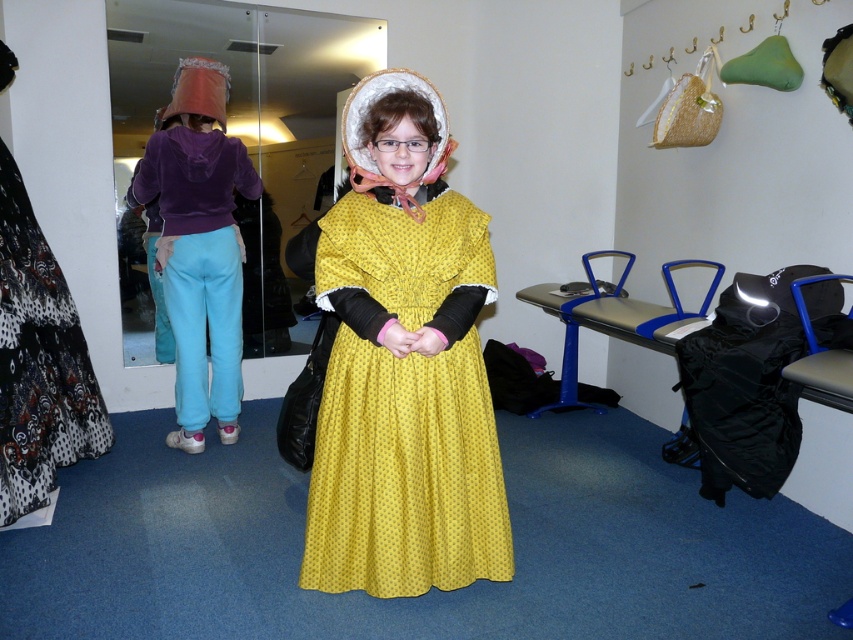
Does purple velvet hoodie at left have a lesser width compared to black and white patterned skirt at left?

No.

Which is behind, point (207, 257) or point (57, 372)?

The point (207, 257) is behind.

Which is in front, point (200, 227) or point (67, 424)?

Point (67, 424) is in front.

At what (x,y) coordinates should I click in order to perform the action: click on purple velvet hoodie at left. Please return your answer as a coordinate pair (x, y). Looking at the image, I should click on (199, 244).

Is yellow dotted fabric dress at center bigger than purple velvet hoodie at left?

No.

This screenshot has width=853, height=640. Describe the element at coordinates (404, 474) in the screenshot. I see `yellow dotted fabric dress at center` at that location.

The width and height of the screenshot is (853, 640). I want to click on yellow dotted fabric dress at center, so click(x=404, y=474).

Measure the distance between yellow dotted fabric dress at center and camera.

yellow dotted fabric dress at center is 6.00 feet from camera.

Is yellow dotted fabric dress at center positioned before black and white patterned skirt at left?

That is True.

Locate an element on the screen. Image resolution: width=853 pixels, height=640 pixels. yellow dotted fabric dress at center is located at coordinates (404, 474).